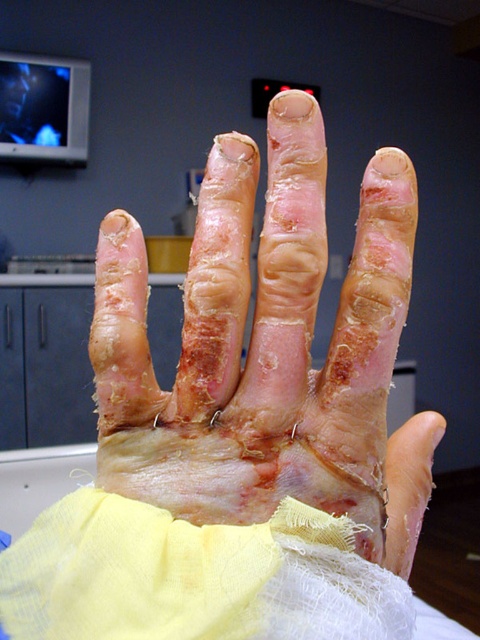
Question: Among these points, which one is nearest to the camera?

Choices:
 (A) (363, 547)
 (B) (232, 616)

Answer: (B)

Question: Observing the image, what is the correct spatial positioning of dry skin at center in reference to yellow gauze at lower left?

Choices:
 (A) left
 (B) right

Answer: (B)

Question: Which point is farther from the camera taking this photo?

Choices:
 (A) (239, 632)
 (B) (201, 301)

Answer: (B)

Question: Does dry skin at center have a greater width compared to yellow gauze at lower left?

Choices:
 (A) no
 (B) yes

Answer: (A)

Question: Can you confirm if dry skin at center is bigger than yellow gauze at lower left?

Choices:
 (A) no
 (B) yes

Answer: (B)

Question: Which of the following is the closest to the observer?

Choices:
 (A) yellow gauze at lower left
 (B) dry skin at center

Answer: (A)